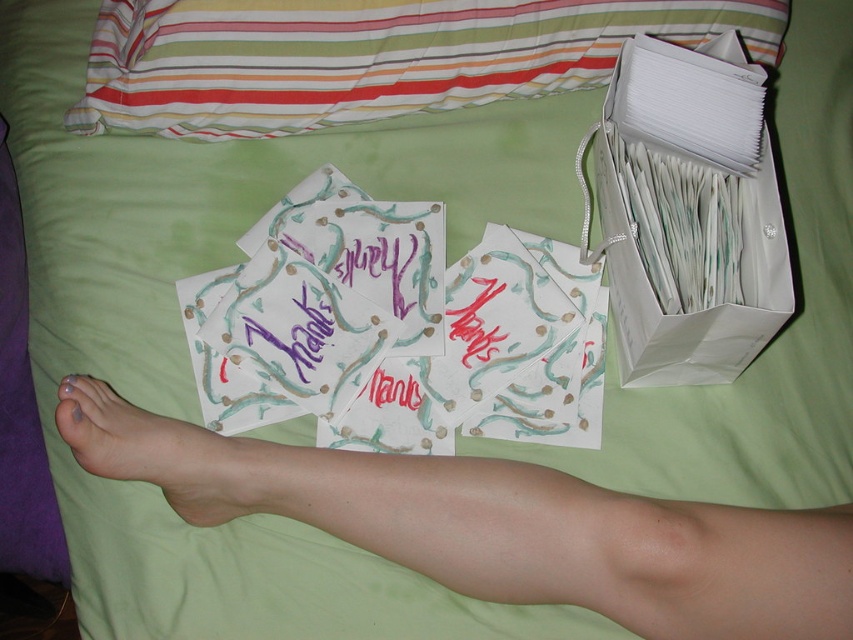
You are taking a photo of the bed with green bedding and need to focus on two specific points marked as point (639, 260) and point (213, 456). Which point should you focus on first to ensure the closest one is in sharp focus?

Point (639, 260) is closer to the camera than point (213, 456), so you should focus on point (639, 260) first to ensure the closest one is in sharp focus.

Looking at this image, you are organizing a card delivery service and need to determine if the pale skin leg at lower center can be placed next to the white paper bag at upper right without overlapping. Based on their widths, will they fit side by side?

The pale skin leg at lower center is wider than the white paper bag at upper right, so they can be placed side by side as long as there is enough space to accommodate both widths.